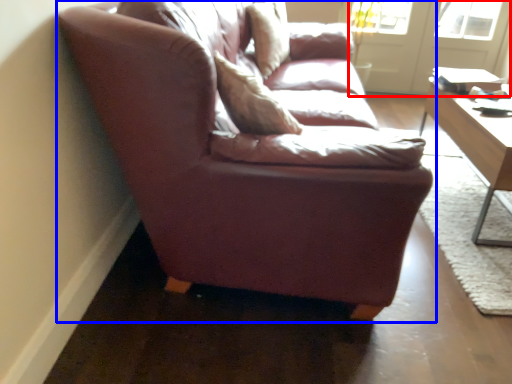
Question: Which of the following is the closest to the observer, screen door (highlighted by a red box) or studio couch (highlighted by a blue box)?

Choices:
 (A) screen door
 (B) studio couch

Answer: (B)